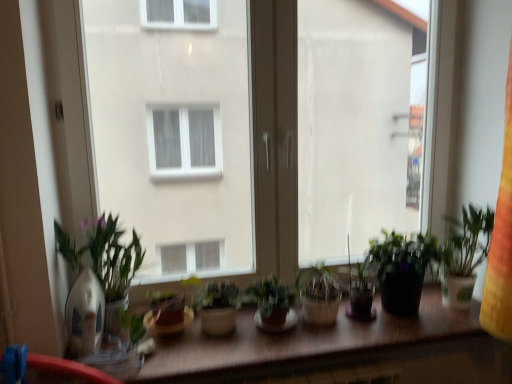
This screenshot has height=384, width=512. Find the location of `vacant space in front of green matte plant at center, which is counted as the third houseplant, starting from the right`. vacant space in front of green matte plant at center, which is counted as the third houseplant, starting from the right is located at coordinates (212, 360).